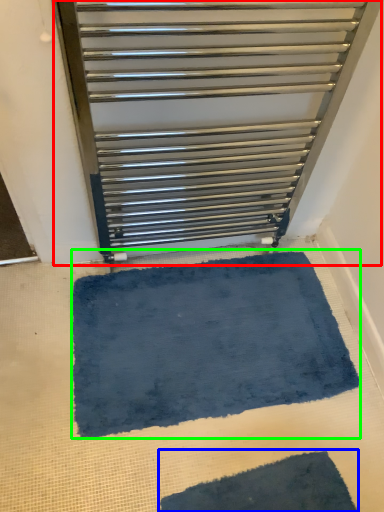
Question: Which is farther away from furniture (highlighted by a red box)? bath mat (highlighted by a blue box) or bath mat (highlighted by a green box)?

Choices:
 (A) bath mat
 (B) bath mat

Answer: (A)